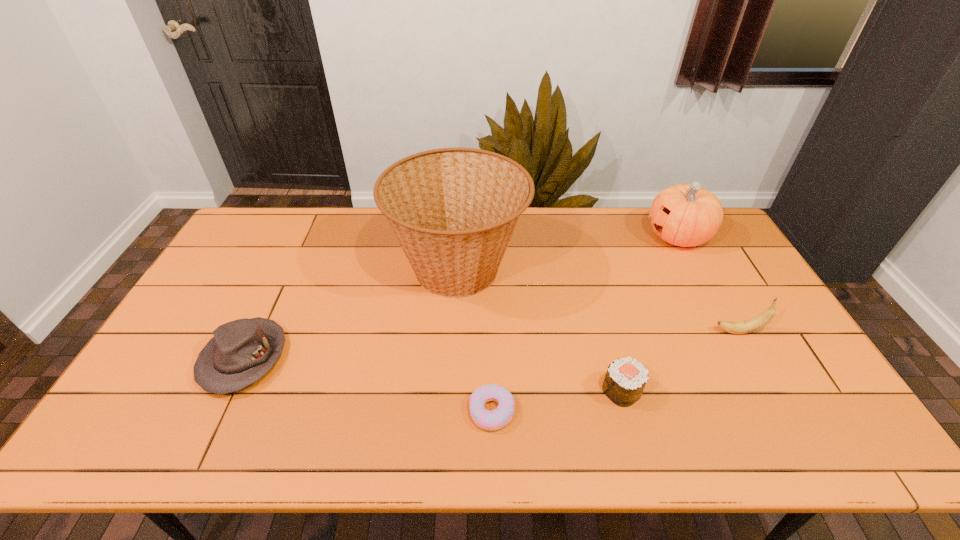
This screenshot has width=960, height=540. Find the location of `unoccupied position between the third object from right to left and the third tallest object`. unoccupied position between the third object from right to left and the third tallest object is located at coordinates (681, 361).

The image size is (960, 540). In order to click on free space that is in between the tallest object and the second tallest object in this screenshot , I will do `click(567, 253)`.

The height and width of the screenshot is (540, 960). Find the location of `blank region between the basket and the sushi`. blank region between the basket and the sushi is located at coordinates (540, 330).

Identify the location of free spot between the leftmost object and the sushi. (433, 375).

Locate an element on the screen. The height and width of the screenshot is (540, 960). vacant point located between the fourth object from left to right and the shortest object is located at coordinates (557, 401).

Find the location of `free spot between the doughnut and the leftmost object`. free spot between the doughnut and the leftmost object is located at coordinates (368, 384).

What are the coordinates of `blank region between the tallest object and the sushi` in the screenshot? It's located at (540, 330).

In order to click on free spot between the fourth shortest object and the sushi in this screenshot , I will do `click(681, 361)`.

Locate an element on the screen. Image resolution: width=960 pixels, height=540 pixels. vacant space that's between the banana and the sushi is located at coordinates (681, 361).

Find the location of a particular element. object that ranks as the closest to the fourth shortest object is located at coordinates (x=625, y=379).